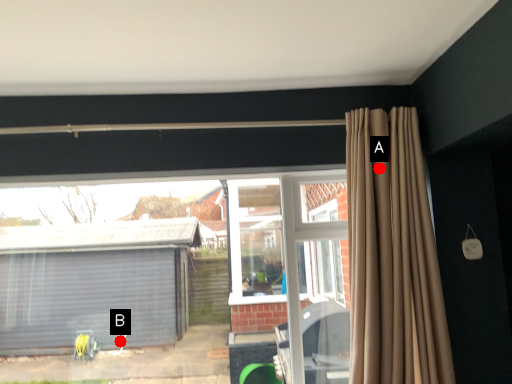
Question: Two points are circled on the image, labeled by A and B beside each circle. Which point appears farthest from the camera in this image?

Choices:
 (A) A is further
 (B) B is further

Answer: (B)